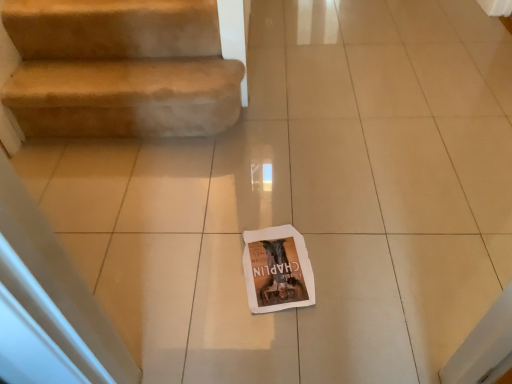
Identify the location of vacant space in front of white paper at center. (289, 354).